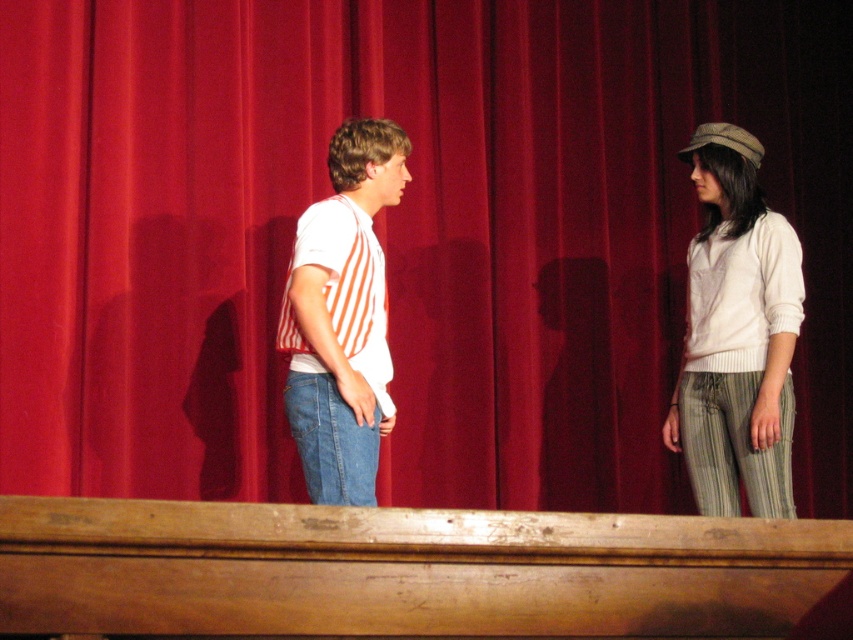
Question: Among these objects, which one is farthest from the camera?

Choices:
 (A) white striped shirt at center
 (B) white knit sweater at right

Answer: (B)

Question: Is the position of white knit sweater at right more distant than that of white striped shirt at center?

Choices:
 (A) yes
 (B) no

Answer: (A)

Question: Is white knit sweater at right below white striped shirt at center?

Choices:
 (A) no
 (B) yes

Answer: (B)

Question: Is white knit sweater at right above white striped shirt at center?

Choices:
 (A) no
 (B) yes

Answer: (A)